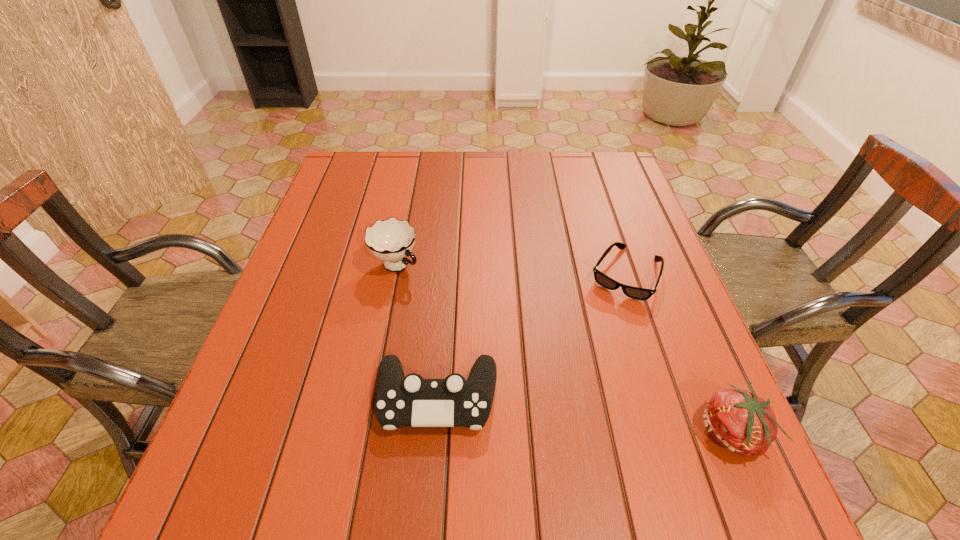
Locate an element on the screen. free space at the far left corner of the desktop is located at coordinates click(x=378, y=167).

You are a GUI agent. You are given a task and a screenshot of the screen. Output one action in this format:
    pyautogui.click(x=<x>, y=<y>)
    Task: Click on the vacant region at the far right corner of the desktop
    
    Given the screenshot: What is the action you would take?
    pyautogui.click(x=592, y=155)

Locate an element on the screen. The height and width of the screenshot is (540, 960). vacant area between the tomato and the shortest object is located at coordinates (678, 353).

This screenshot has width=960, height=540. I want to click on free area in between the control and the shortest object, so click(531, 336).

At what (x,y) coordinates should I click in order to perform the action: click on vacant area that lies between the sunglasses and the cup. Please return your answer as a coordinate pair (x, y). Looking at the image, I should click on (511, 269).

Image resolution: width=960 pixels, height=540 pixels. Identify the location of free point between the control and the cup. (417, 332).

At what (x,y) coordinates should I click in order to perform the action: click on vacant point located between the sunglasses and the control. Please return your answer as a coordinate pair (x, y). Looking at the image, I should click on (531, 336).

Where is `vacant region between the tomato and the control`? This screenshot has width=960, height=540. vacant region between the tomato and the control is located at coordinates (584, 415).

This screenshot has width=960, height=540. I want to click on vacant area between the cup and the control, so click(x=417, y=332).

Where is `blank region between the control and the tomato`? This screenshot has width=960, height=540. blank region between the control and the tomato is located at coordinates (584, 415).